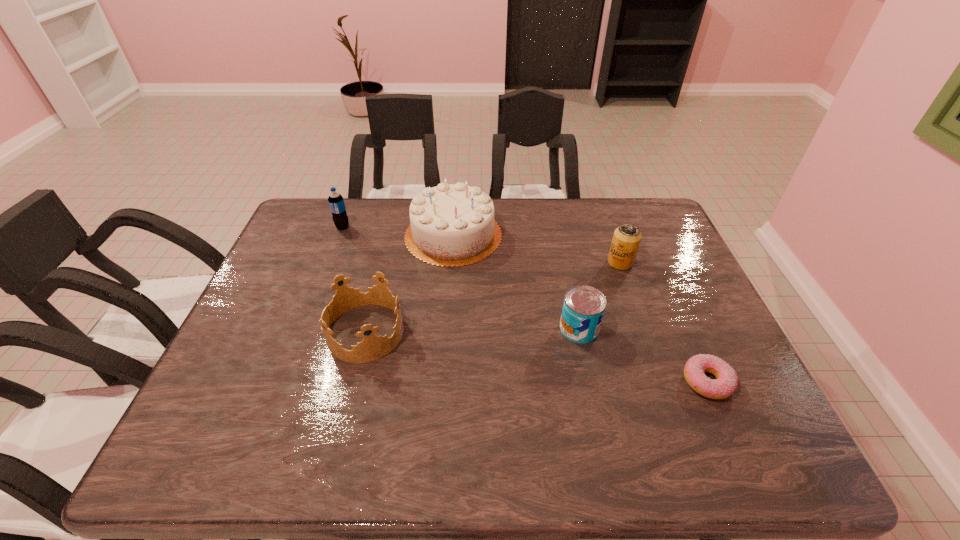
Where is `free space located on the front of the beer can`? The height and width of the screenshot is (540, 960). free space located on the front of the beer can is located at coordinates (662, 382).

You are a GUI agent. You are given a task and a screenshot of the screen. Output one action in this format:
    pyautogui.click(x=<x>, y=<y>)
    Task: Click on the vacant region located 0.160m on the front-facing side of the tiara
    This screenshot has width=960, height=540.
    Given the screenshot: What is the action you would take?
    pyautogui.click(x=467, y=332)

Locate an element on the screen. vacant space situated on the back of the fourth object from left to right is located at coordinates (564, 255).

Identify the location of vacant space located 0.080m on the left of the doughnut. The image size is (960, 540). (647, 382).

Where is `birthday cake positioned at the far edge`? The image size is (960, 540). birthday cake positioned at the far edge is located at coordinates (451, 225).

Identify the location of soda bottle that is at the far edge. (336, 202).

Locate an element on the screen. The width and height of the screenshot is (960, 540). object at the left edge is located at coordinates (336, 202).

This screenshot has width=960, height=540. I want to click on beer can at the right edge, so click(x=626, y=240).

The width and height of the screenshot is (960, 540). I want to click on doughnut that is at the right edge, so click(x=726, y=382).

Identify the location of object that is at the far left corner. (336, 202).